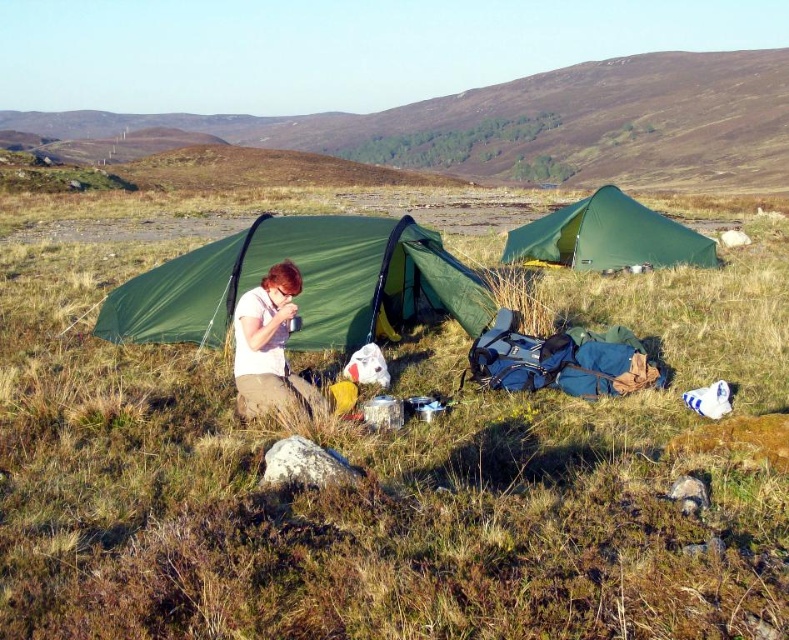
Question: Can you confirm if green canvas tent at center is positioned to the right of matte white mug at center?

Choices:
 (A) no
 (B) yes

Answer: (B)

Question: Which is farther from the green canvas tent at center?

Choices:
 (A) matte white mug at center
 (B) green fabric tent at center

Answer: (A)

Question: Can you confirm if green fabric tent at center is wider than matte white mug at center?

Choices:
 (A) no
 (B) yes

Answer: (B)

Question: Which object is farther from the camera taking this photo?

Choices:
 (A) green fabric tent at center
 (B) green canvas tent at center
 (C) matte white mug at center

Answer: (B)

Question: Observing the image, what is the correct spatial positioning of green fabric tent at center in reference to green canvas tent at center?

Choices:
 (A) left
 (B) right

Answer: (A)

Question: Which point is farther to the camera?

Choices:
 (A) [645, 232]
 (B) [288, 241]

Answer: (A)